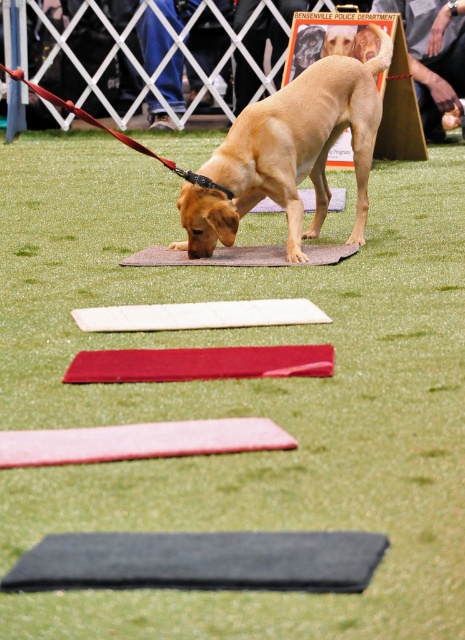
Does golden fur dog at center have a greater height compared to smooth wooden board at upper center?

Incorrect, golden fur dog at center's height is not larger of smooth wooden board at upper center's.

Does golden fur dog at center have a greater width compared to smooth wooden board at upper center?

Yes.

What do you see at coordinates (289, 154) in the screenshot?
I see `golden fur dog at center` at bounding box center [289, 154].

Locate an element on the screen. The height and width of the screenshot is (640, 465). golden fur dog at center is located at coordinates (289, 154).